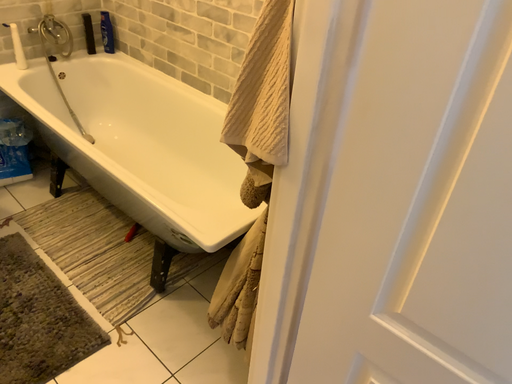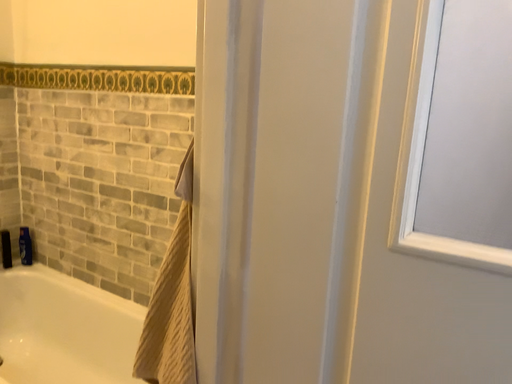
Question: Which way did the camera rotate in the video?

Choices:
 (A) rotated upward
 (B) rotated downward

Answer: (A)